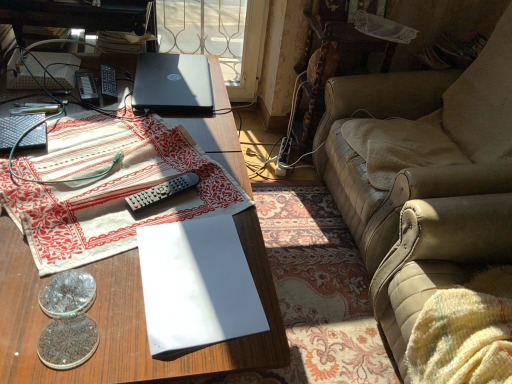
This screenshot has width=512, height=384. I want to click on empty space that is in between black plastic remote control at upper left, the 2th remote control when ordered from top to bottom, and translucent glass coins at lower left, which is counted as the 2th coin, starting from the back, so click(80, 170).